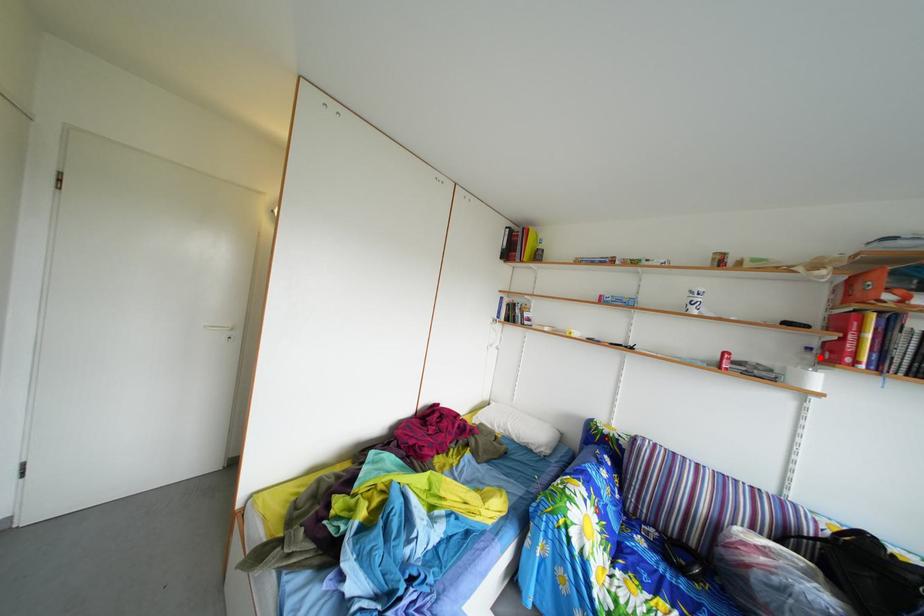
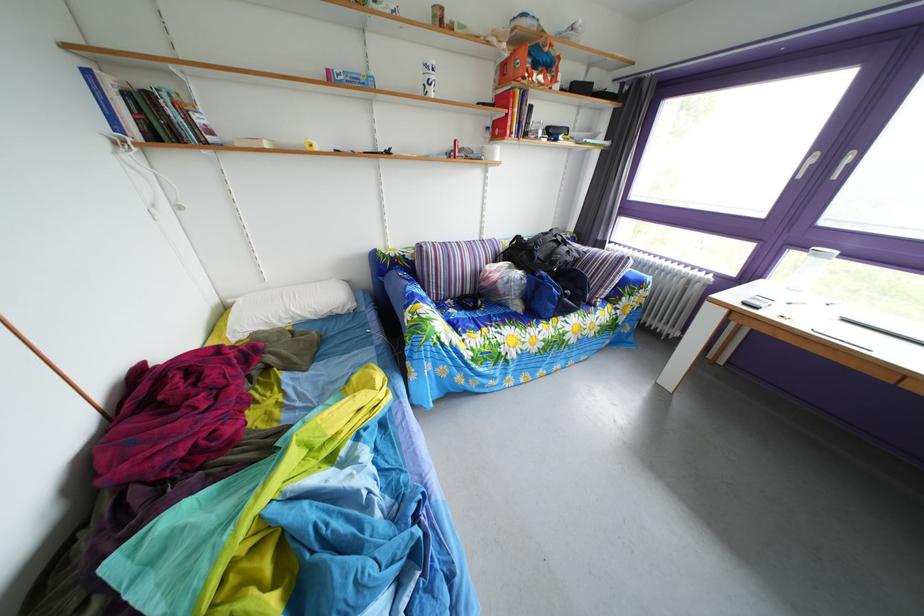
Question: I am providing you with two images of the same scene from different viewpoints. Image1 has a red point marked. In image2, the corresponding 3D location appears at what relative position? Reply with the corresponding letter.

Choices:
 (A) Closer
 (B) Farther

Answer: (A)